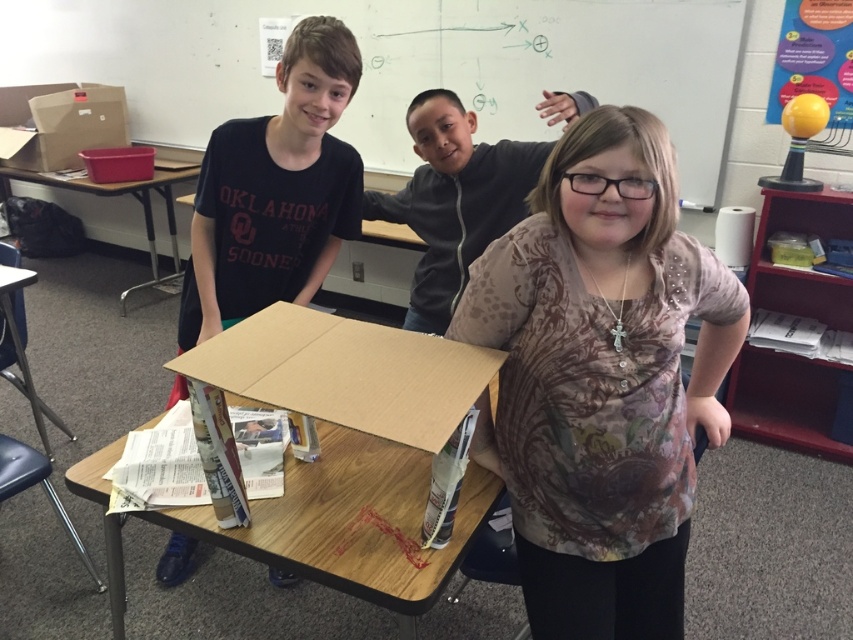
Is the position of black matte shirt at center more distant than that of dark gray zip-up hoodie at center?

No, black matte shirt at center is closer to the viewer.

The height and width of the screenshot is (640, 853). What are the coordinates of `black matte shirt at center` in the screenshot? It's located at (276, 189).

Who is taller, dark gray zip-up hoodie at center or wooden table at left?

Standing taller between the two is wooden table at left.

Who is more forward, [422,310] or [173,196]?

Point [422,310] is in front.

Where is `dark gray zip-up hoodie at center`? This screenshot has height=640, width=853. dark gray zip-up hoodie at center is located at coordinates 454,200.

In the scene shown: Is brown cardboard box at upper left closer to camera compared to wooden table at left?

That is False.

The height and width of the screenshot is (640, 853). What do you see at coordinates (59, 124) in the screenshot?
I see `brown cardboard box at upper left` at bounding box center [59, 124].

Find the location of a particular element. This screenshot has height=640, width=853. brown cardboard box at upper left is located at coordinates (59, 124).